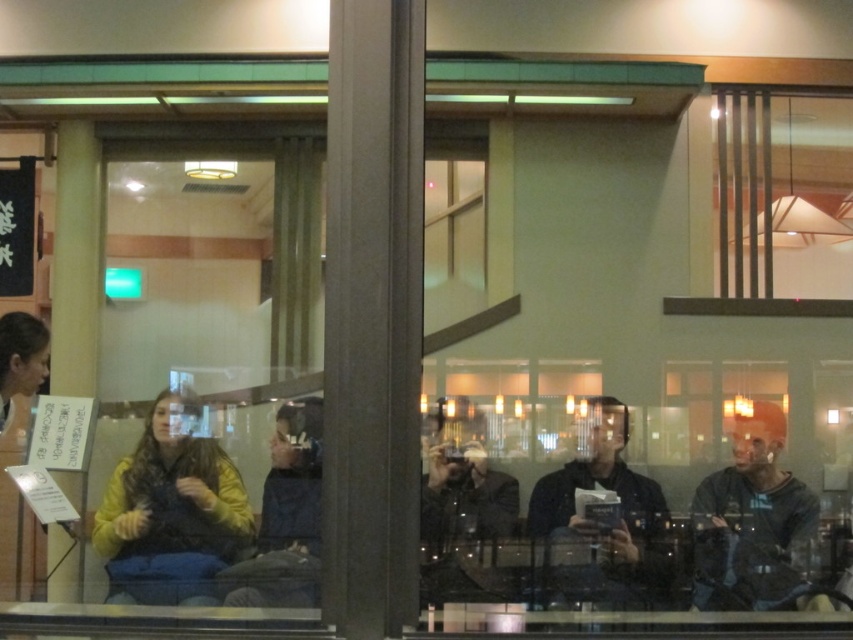
Does yellow fleece sweater at lower left have a lesser height compared to dark brown hair at left?

No, yellow fleece sweater at lower left is not shorter than dark brown hair at left.

Who is lower down, yellow fleece sweater at lower left or dark brown hair at left?

yellow fleece sweater at lower left

Locate an element on the screen. yellow fleece sweater at lower left is located at coordinates (171, 512).

Which is more to the right, dark gray sweater at right or yellow fabric jacket at center?

From the viewer's perspective, dark gray sweater at right appears more on the right side.

I want to click on dark gray sweater at right, so (x=750, y=518).

Between point (708, 561) and point (300, 486), which one is positioned in front?

Point (708, 561)

You are a GUI agent. You are given a task and a screenshot of the screen. Output one action in this format:
    pyautogui.click(x=<x>, y=<y>)
    Task: Click on the dark gray sweater at right
    
    Given the screenshot: What is the action you would take?
    pyautogui.click(x=750, y=518)

Is dark gray sweater at right thinner than denim jacket at center?

No, dark gray sweater at right is not thinner than denim jacket at center.

The image size is (853, 640). What do you see at coordinates (750, 518) in the screenshot? I see `dark gray sweater at right` at bounding box center [750, 518].

Identify the location of dark gray sweater at right. (750, 518).